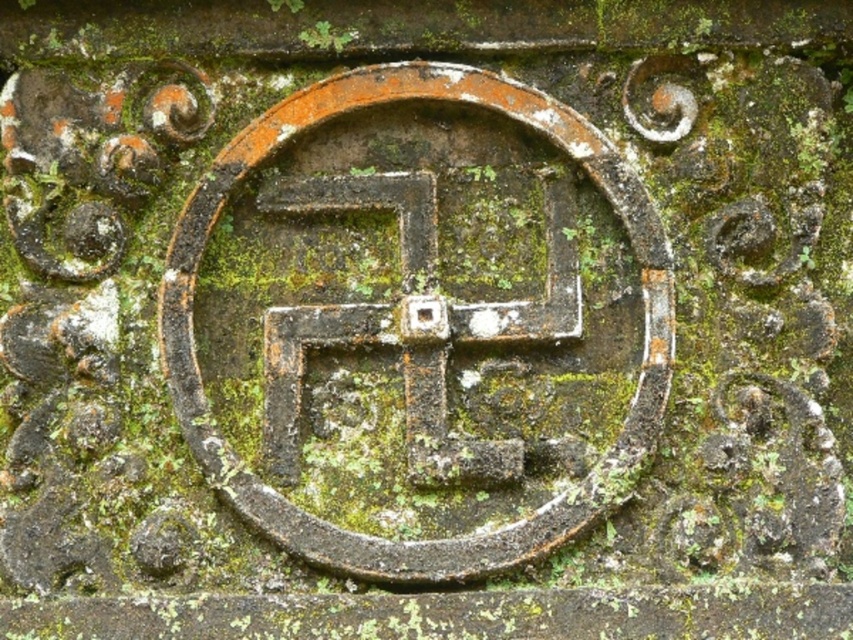
Question: Which point is farther to the camera?

Choices:
 (A) rusty metal swastika at center
 (B) rusty metal cross at center

Answer: (B)

Question: Which object appears closest to the camera in this image?

Choices:
 (A) rusty metal cross at center
 (B) rusty metal swastika at center

Answer: (B)

Question: Is rusty metal swastika at center thinner than rusty metal cross at center?

Choices:
 (A) yes
 (B) no

Answer: (B)

Question: Is rusty metal swastika at center in front of rusty metal cross at center?

Choices:
 (A) yes
 (B) no

Answer: (A)

Question: Among these objects, which one is nearest to the camera?

Choices:
 (A) rusty metal swastika at center
 (B) rusty metal cross at center

Answer: (A)

Question: In this image, where is rusty metal swastika at center located relative to rusty metal cross at center?

Choices:
 (A) above
 (B) below

Answer: (B)